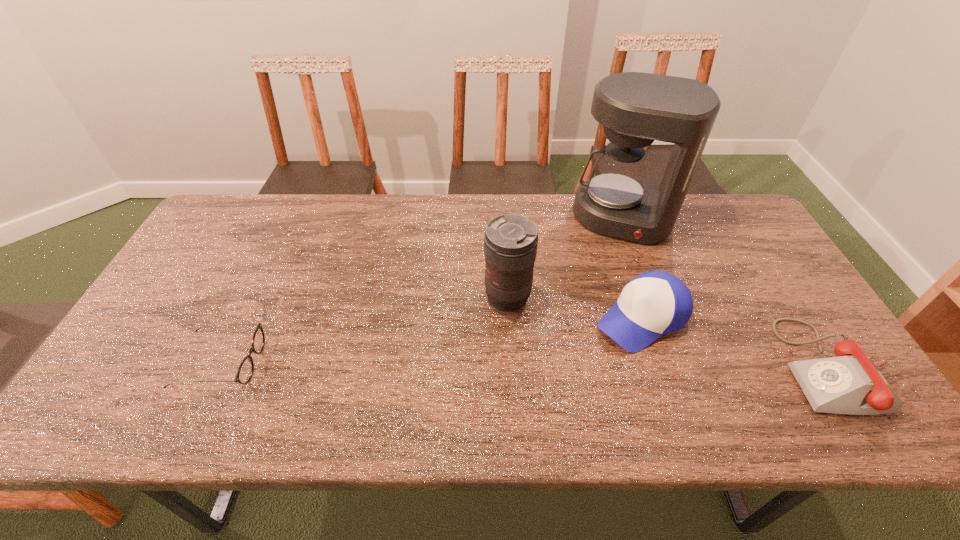
The height and width of the screenshot is (540, 960). In order to click on free spot on the desktop that is between the leftmost object and the rightmost object and is positioned on the side of the second tallest object where the control switches are located in this screenshot , I will do `click(437, 364)`.

What are the coordinates of `vacant space on the desktop that is between the spectacles and the second shortest object and is positioned on the front-facing side of the tallest object` in the screenshot? It's located at click(x=588, y=365).

The image size is (960, 540). In order to click on free space on the desktop that is between the shortest object and the telephone and is positioned on the front-facing side of the third tallest object in this screenshot , I will do `click(570, 364)`.